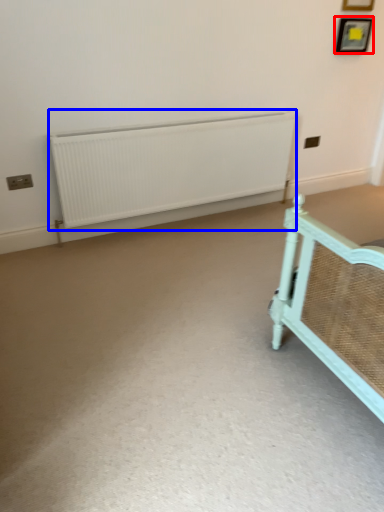
Question: Which of the following is the closest to the observer, picture frame (highlighted by a red box) or radiator (highlighted by a blue box)?

Choices:
 (A) picture frame
 (B) radiator

Answer: (B)